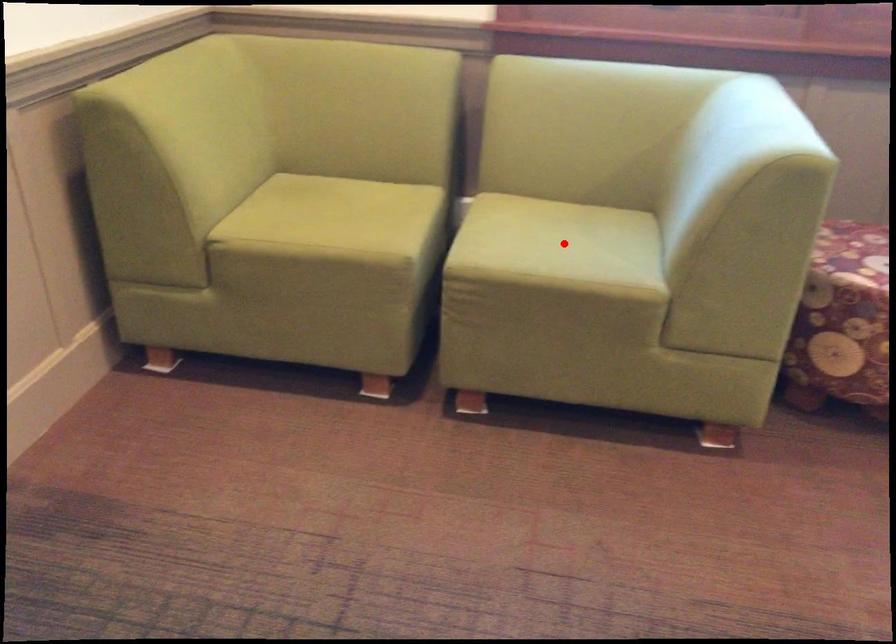
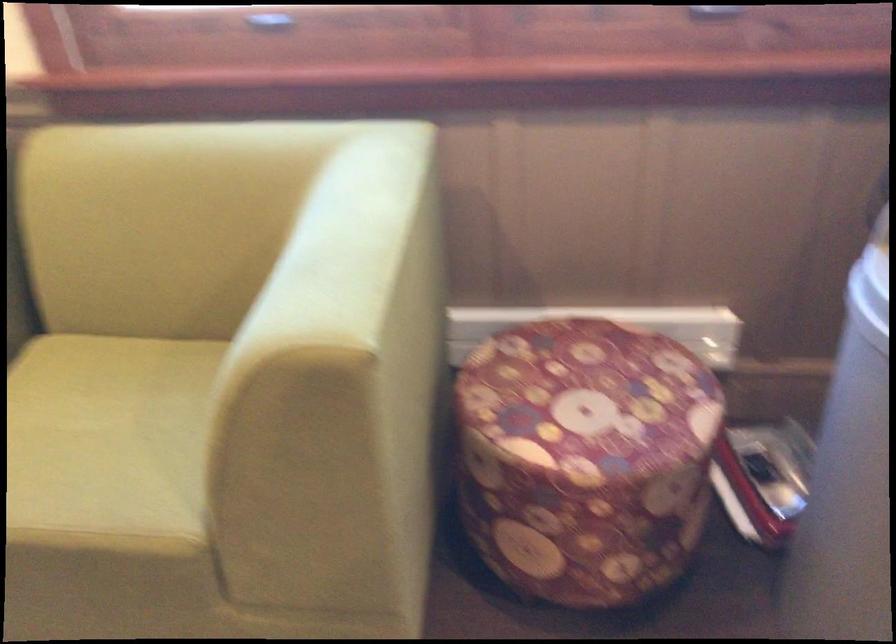
Locate, in the second image, the point that corresponds to the highlighted location in the first image.

(107, 442)